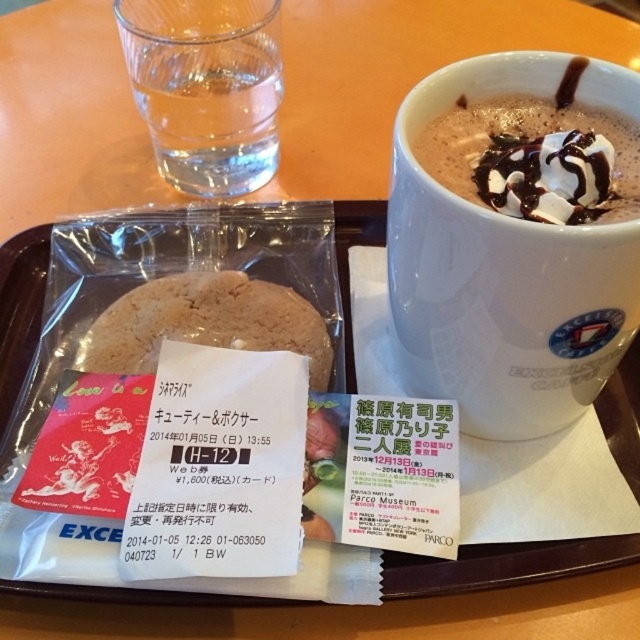
Question: Which of the following is the closest to the observer?

Choices:
 (A) white glossy mug at upper center
 (B) chocolate frothy beverage at upper right
 (C) clear glass water at upper left

Answer: (A)

Question: Can you confirm if white glossy mug at upper center is smaller than clear glass water at upper left?

Choices:
 (A) no
 (B) yes

Answer: (A)

Question: Is clear glass water at upper left thinner than chocolate frothy beverage at upper right?

Choices:
 (A) yes
 (B) no

Answer: (A)

Question: Which point appears farthest from the camera in this image?

Choices:
 (A) (180, 324)
 (B) (474, 141)
 (C) (179, 154)

Answer: (C)

Question: Which point is farther from the camera taking this photo?

Choices:
 (A) (538, 115)
 (B) (163, 84)
 (C) (296, 330)
 (D) (532, 227)

Answer: (B)

Question: In this image, where is white glossy mug at upper center located relative to clear glass water at upper left?

Choices:
 (A) left
 (B) right

Answer: (B)